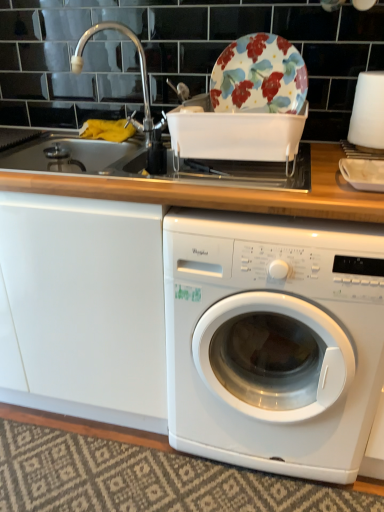
Question: Is the depth of silver metallic faucet at upper left less than that of white matte plate at right?

Choices:
 (A) no
 (B) yes

Answer: (A)

Question: Is silver metallic faucet at upper left aimed at white matte plate at right?

Choices:
 (A) no
 (B) yes

Answer: (A)

Question: Considering the relative sizes of silver metallic faucet at upper left and white matte plate at right in the image provided, is silver metallic faucet at upper left shorter than white matte plate at right?

Choices:
 (A) no
 (B) yes

Answer: (A)

Question: Can you confirm if silver metallic faucet at upper left is thinner than white matte plate at right?

Choices:
 (A) yes
 (B) no

Answer: (B)

Question: Can we say silver metallic faucet at upper left lies outside white matte plate at right?

Choices:
 (A) no
 (B) yes

Answer: (B)

Question: Is white matte plate at right situated inside white plastic washing machine at center or outside?

Choices:
 (A) inside
 (B) outside

Answer: (B)

Question: Considering the positions of white matte plate at right and white plastic washing machine at center in the image, is white matte plate at right bigger or smaller than white plastic washing machine at center?

Choices:
 (A) big
 (B) small

Answer: (B)

Question: Relative to white plastic washing machine at center, is white matte plate at right in front or behind?

Choices:
 (A) front
 (B) behind

Answer: (B)

Question: From their relative heights in the image, would you say white matte plate at right is taller or shorter than white plastic washing machine at center?

Choices:
 (A) tall
 (B) short

Answer: (B)

Question: In terms of height, does floral ceramic plate at upper center look taller or shorter compared to silver metallic faucet at upper left?

Choices:
 (A) tall
 (B) short

Answer: (B)

Question: From the image's perspective, is floral ceramic plate at upper center above or below silver metallic faucet at upper left?

Choices:
 (A) above
 (B) below

Answer: (B)

Question: Looking at the image, does floral ceramic plate at upper center seem bigger or smaller compared to silver metallic faucet at upper left?

Choices:
 (A) big
 (B) small

Answer: (B)

Question: Relative to silver metallic faucet at upper left, is floral ceramic plate at upper center in front or behind?

Choices:
 (A) front
 (B) behind

Answer: (A)

Question: From a real-world perspective, is silver metallic faucet at upper left above or below white plastic washing machine at center?

Choices:
 (A) above
 (B) below

Answer: (A)

Question: From the image's perspective, is silver metallic faucet at upper left positioned above or below white plastic washing machine at center?

Choices:
 (A) below
 (B) above

Answer: (B)